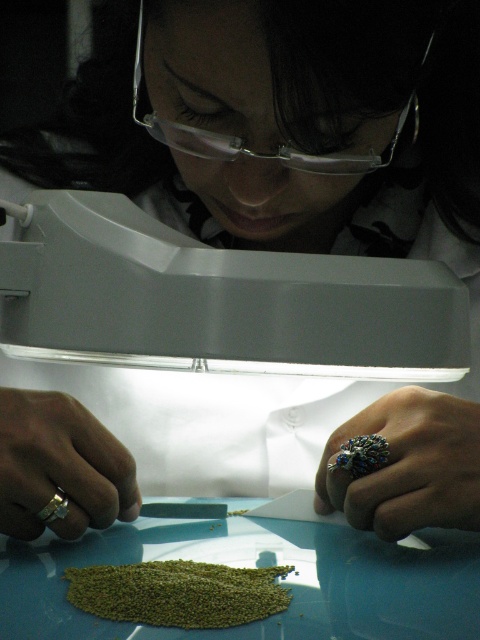
Question: Where is silver metallic ring at lower right located in relation to gold ring at lower left in the image?

Choices:
 (A) right
 (B) left

Answer: (A)

Question: Considering the real-world distances, which object is farthest from the clear plastic goggles at upper center?

Choices:
 (A) gold ring at lower left
 (B) silver metallic ring at lower right

Answer: (A)

Question: Is silver metallic ring at lower right bigger than gold ring at lower left?

Choices:
 (A) yes
 (B) no

Answer: (A)

Question: Based on their relative distances, which object is nearer to the silver metallic ring at lower right?

Choices:
 (A) clear plastic goggles at upper center
 (B) gold ring at lower left

Answer: (B)

Question: Considering the real-world distances, which object is closest to the silver metallic ring at lower right?

Choices:
 (A) gold ring at lower left
 (B) clear plastic goggles at upper center

Answer: (A)

Question: Where is silver metallic ring at lower right located in relation to gold ring at lower left in the image?

Choices:
 (A) right
 (B) left

Answer: (A)